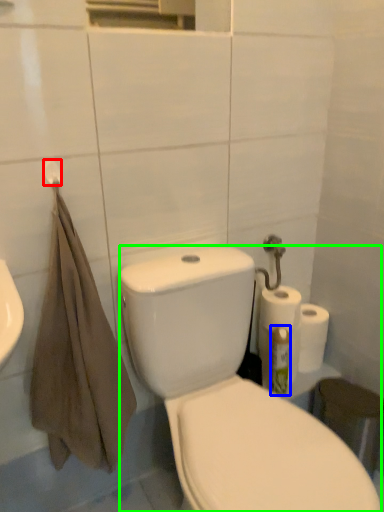
Question: Which object is the farthest from towel bar (highlighted by a red box)? Choose among these: cleaning product (highlighted by a blue box) or porcelain (highlighted by a green box).

Choices:
 (A) cleaning product
 (B) porcelain

Answer: (A)